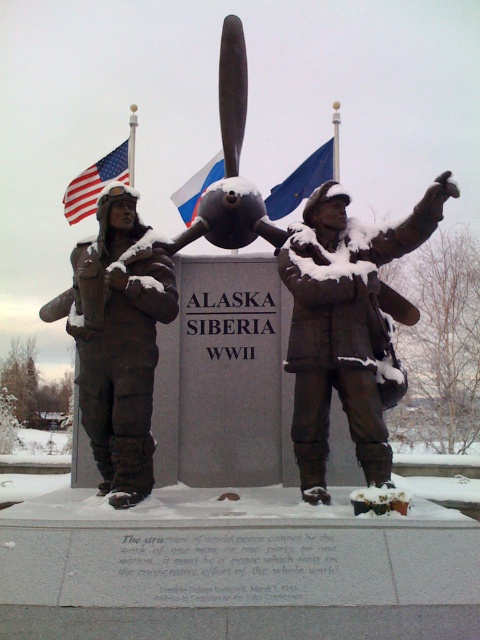
Consider the image. You are standing at the center of the monument. Looking at the bronze statue of soldier at left, can you tell me its coordinates in the image? Please provide the coordinates as a point in the format of x,y.

The bronze statue of soldier at left is located at coordinates point (120, 340).

You are a photographer trying to capture the monument in a way that both the bronze statue of soldier at left and the black matte propeller at center are clearly visible. Given their height difference, which object should you position closer to the camera to ensure both are in focus and properly framed?

The bronze statue of soldier at left is taller than the black matte propeller at center. To ensure both are in focus and properly framed, position the camera so that the shorter black matte propeller at center is closer to the lens, allowing the statue and propeller to align vertically within the frame.

You are a historian examining the monument. You notice a point at coordinates (230, 163). What object is located at this point?

The black matte propeller at center is located at point (230, 163).